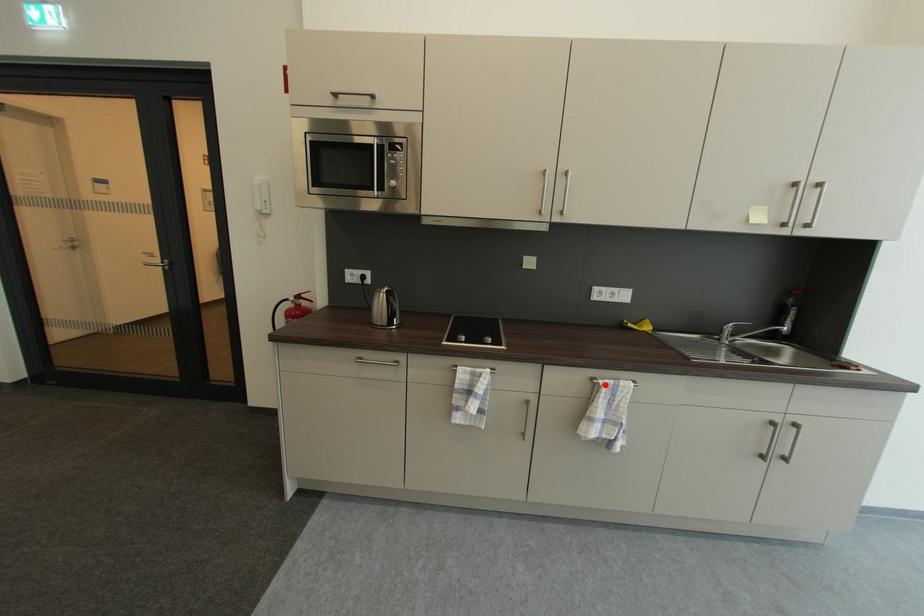
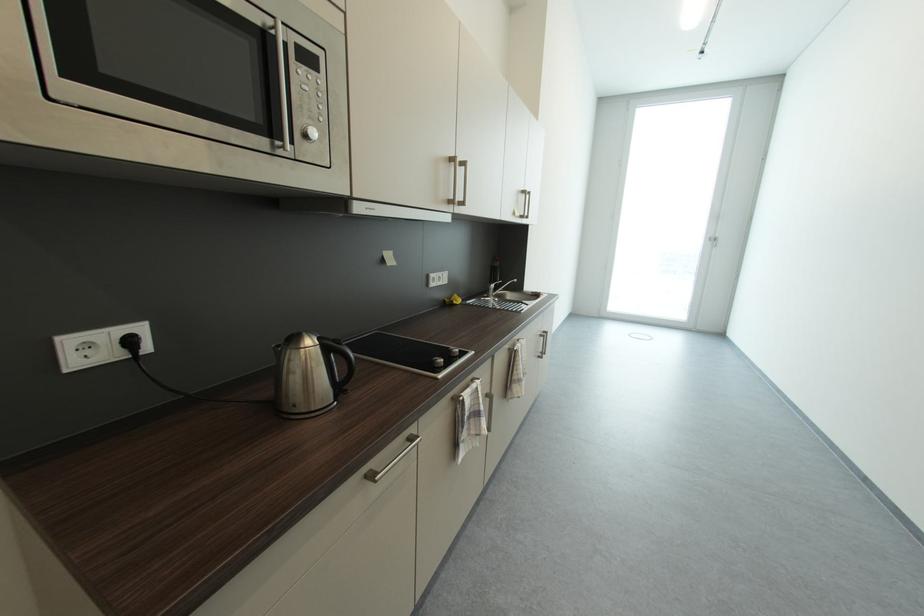
Find the pixel in the second image that matches the highlighted location in the first image.

(523, 351)